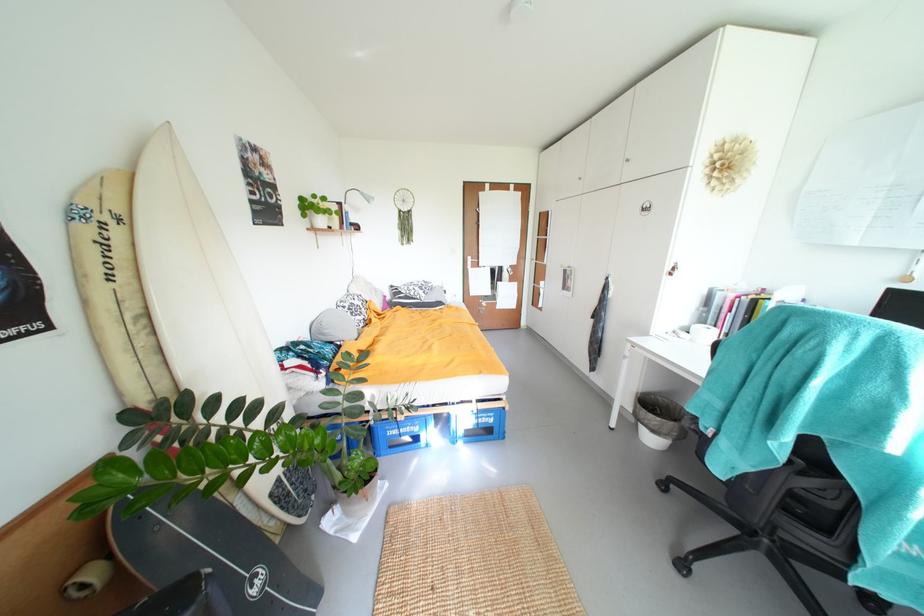
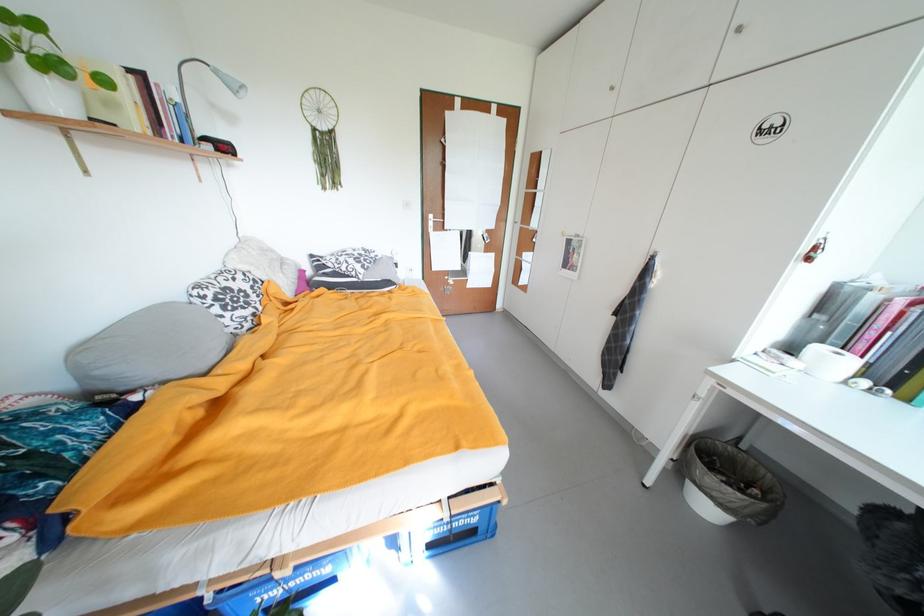
The point at (478, 260) is marked in the first image. Where is the corresponding point in the second image?

(439, 217)